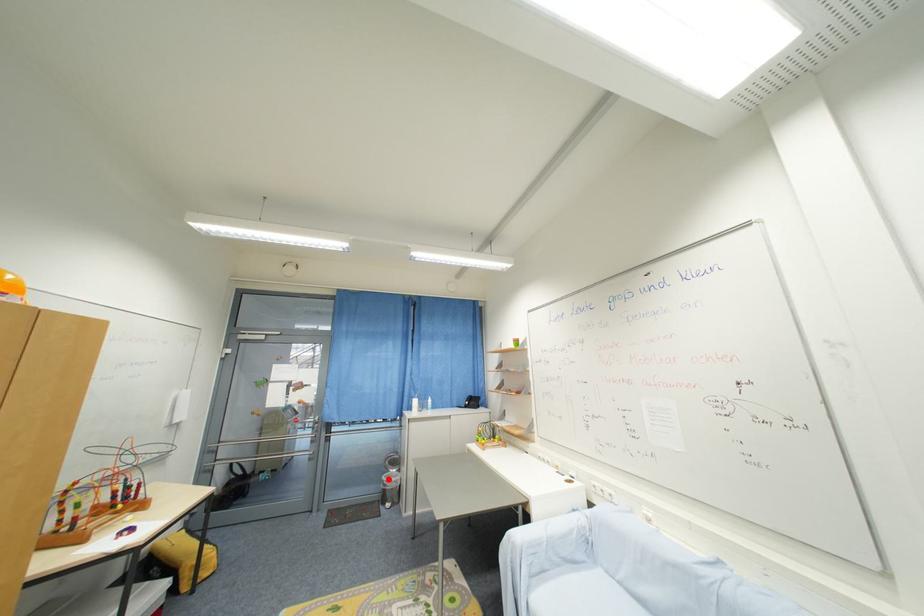
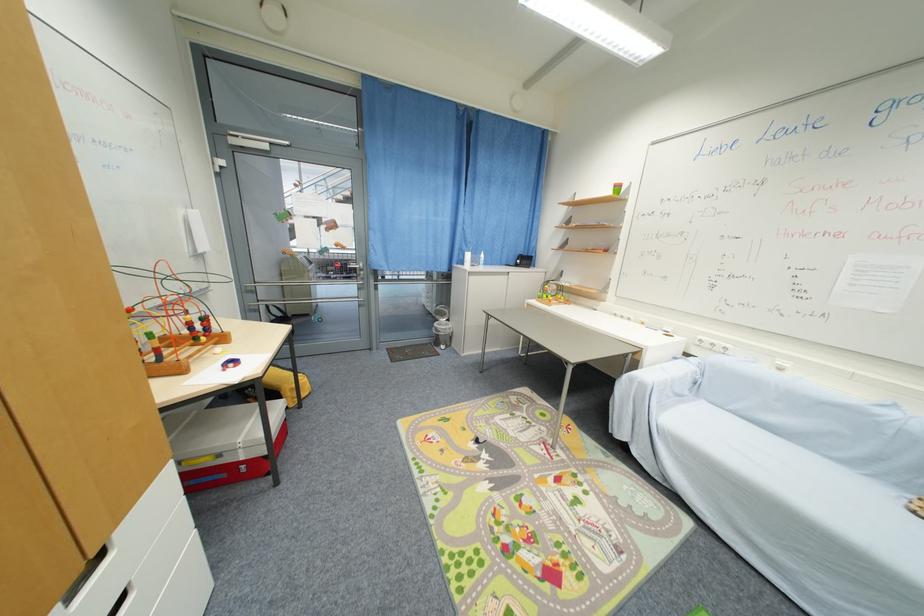
Question: A red point is marked in image1. In image2, is the corresponding 3D point closer to the camera or farther? Reply with the corresponding letter.

Choices:
 (A) The corresponding 3D point is closer.
 (B) The corresponding 3D point is farther.

Answer: (A)